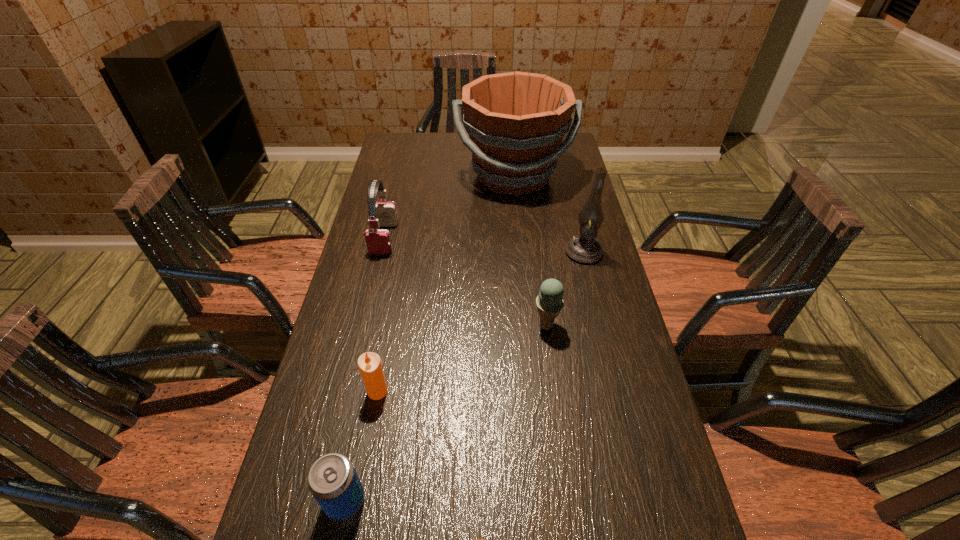
You are a GUI agent. You are given a task and a screenshot of the screen. Output one action in this format:
    pyautogui.click(x=<x>, y=<y>)
    Task: Click on the vacant space located on the left of the fifth farthest object
    The image size is (960, 540).
    Given the screenshot: What is the action you would take?
    pyautogui.click(x=340, y=392)

Locate an element on the screen. vacant region located on the back of the second nearest object is located at coordinates (378, 339).

Find the location of a particular element. The height and width of the screenshot is (540, 960). object situated at the far edge is located at coordinates (516, 121).

Where is `earphone located in the left edge section of the desktop`? earphone located in the left edge section of the desktop is located at coordinates (378, 241).

The image size is (960, 540). In order to click on candle situated at the left edge in this screenshot , I will do `click(369, 364)`.

Where is `beer can present at the left edge`? beer can present at the left edge is located at coordinates (332, 480).

Find the location of a particular element. The height and width of the screenshot is (540, 960). bucket present at the right edge is located at coordinates (516, 121).

You are a GUI agent. You are given a task and a screenshot of the screen. Output one action in this format:
    pyautogui.click(x=<x>, y=<y>)
    Task: Click on the oil lamp that is at the right edge
    
    Given the screenshot: What is the action you would take?
    pyautogui.click(x=584, y=248)

Where is `object that is positioned at the far right corner`? object that is positioned at the far right corner is located at coordinates (516, 121).

In the image, there is a desktop. Identify the location of vacant region at the far edge. (440, 153).